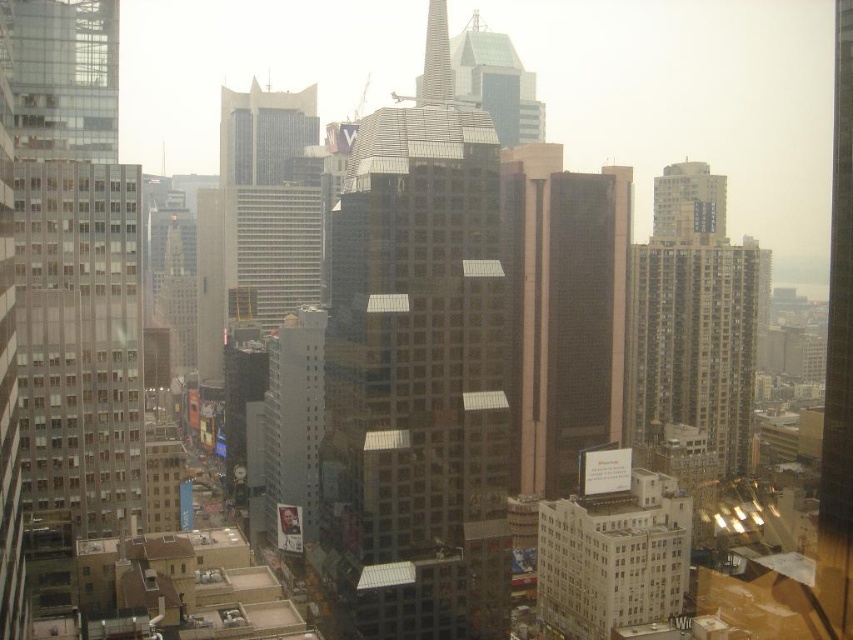
You are standing at a viewpoint overlooking the city and want to determine the order of the two points in the skyline. Which point, point [456,234] or point [575,596], is closer to you?

Point [456,234] is in front of point [575,596], so it is closer to you.

You are an architect analyzing the urban skyline. You notice the transparent glass skyscraper at left and the white concrete billboard at lower right. Which structure is taller?

The transparent glass skyscraper at left is taller than the white concrete billboard at lower right.

You are a drone operator trying to deliver a package to a building in this urban skyline. Your GPS shows a delivery point at coordinates point [70,268]. According to the image, which building should you fly towards?

The point [70,268] is on transparent glass skyscraper at left, so you should fly towards the transparent glass skyscraper at left.